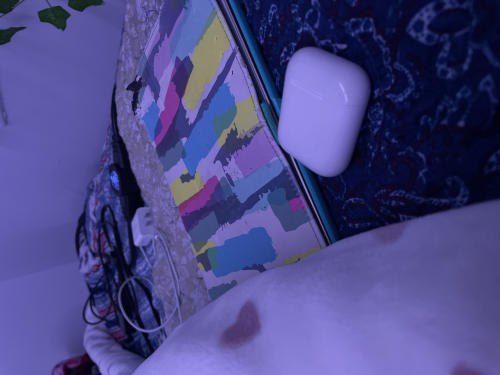
At what (x,y) coordinates should I click in order to perform the action: click on rounded white box for storing ear phones. Please return your answer as a coordinate pair (x, y). Looking at the image, I should click on (310, 136).